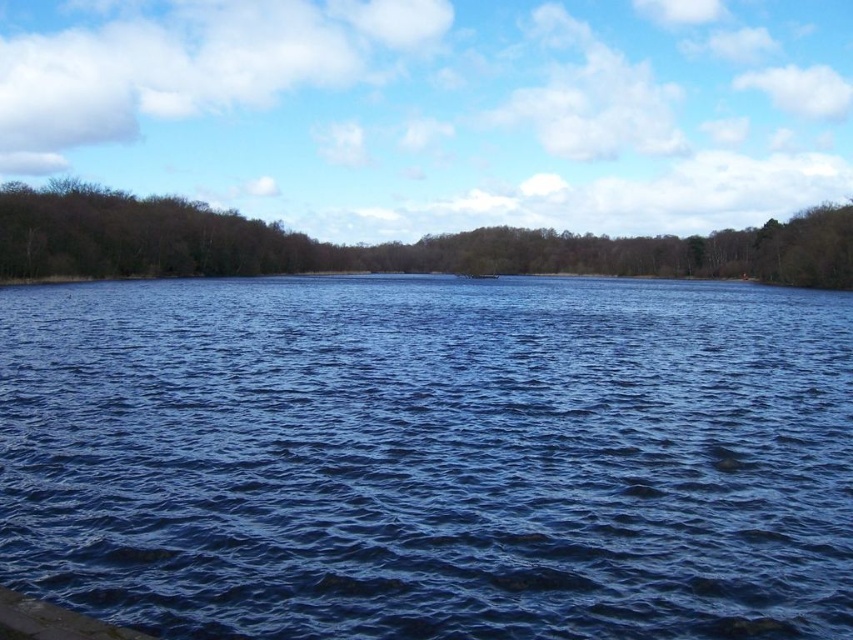
Does blue liquid water at center appear under brown/dry wood trees at upper left?

Indeed, blue liquid water at center is positioned under brown/dry wood trees at upper left.

Which is behind, point (492, 298) or point (640, 260)?

Point (640, 260)

Which is in front, point (401, 541) or point (616, 237)?

Point (401, 541) is more forward.

At what (x,y) coordinates should I click in order to perform the action: click on blue liquid water at center. Please return your answer as a coordinate pair (x, y). This screenshot has width=853, height=640. Looking at the image, I should click on (430, 458).